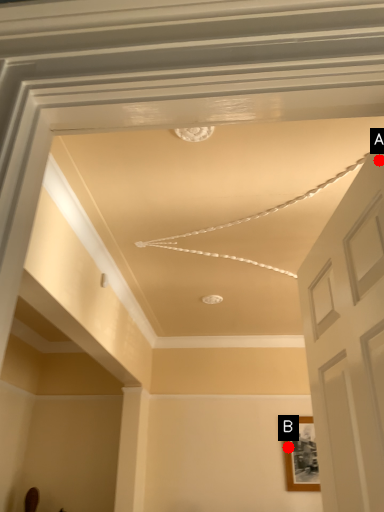
Question: Two points are circled on the image, labeled by A and B beside each circle. Among these points, which one is nearest to the camera?

Choices:
 (A) A is closer
 (B) B is closer

Answer: (A)